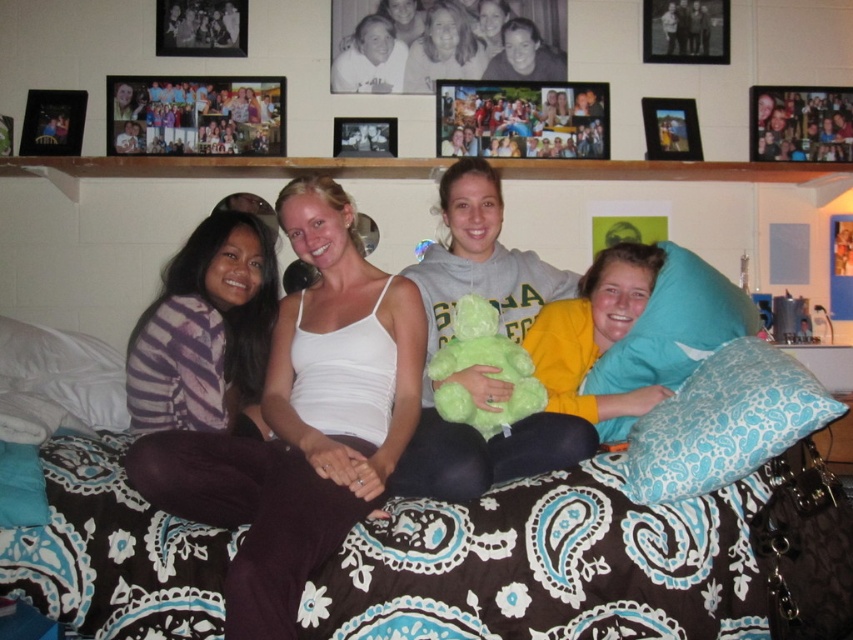
You are trying to decide which frame to use for your new photo. The metallic photo frame at upper left and the wooden picture frame at upper right are both options. Based on their sizes, which one would you choose if you want a larger frame?

The metallic photo frame at upper left is bigger than the wooden picture frame at upper right, so you should choose the metallic photo frame at upper left if you want a larger frame.

You are a photographer trying to take a group photo of the four people sitting on the bed. You notice the green plush bear at center and the blue paisley pillow at right in the frame. Based on their sizes, which object should you move to avoid blocking the view of the people?

The green plush bear at center is much taller than the blue paisley pillow at right, so you should move the green plush bear at center to avoid blocking the view of the people.